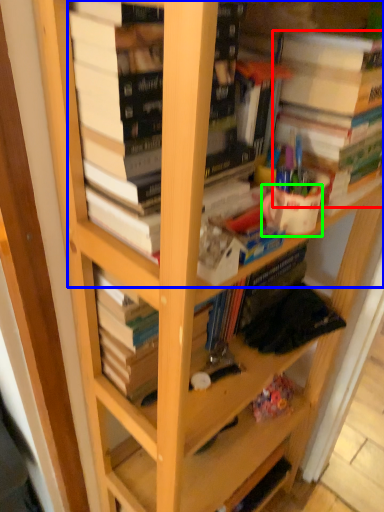
Question: Based on their relative distances, which object is nearer to book (highlighted by a red box)? Choose from book (highlighted by a blue box) and coffee cup (highlighted by a green box).

Choices:
 (A) book
 (B) coffee cup

Answer: (B)